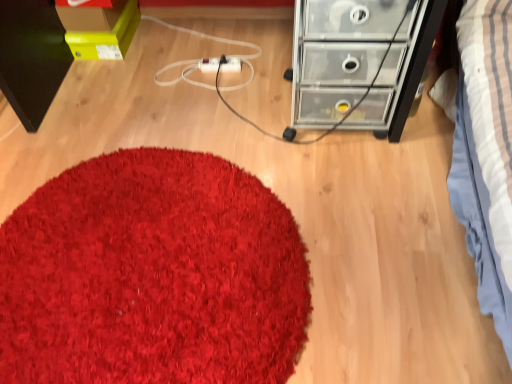
The height and width of the screenshot is (384, 512). I want to click on vacant area that lies between white plastic extension cord at center and transparent plastic chest of drawers at upper right, so click(x=252, y=90).